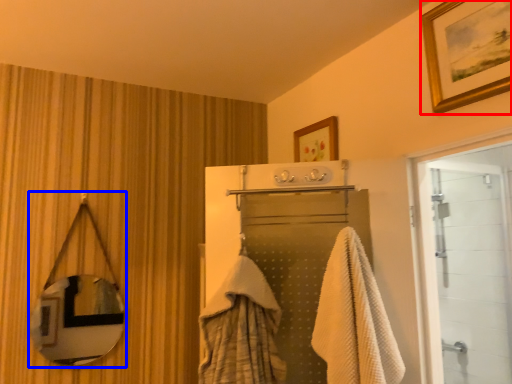
Question: Which of the following is the farthest to the observer, picture frame (highlighted by a red box) or mirror (highlighted by a blue box)?

Choices:
 (A) picture frame
 (B) mirror

Answer: (B)